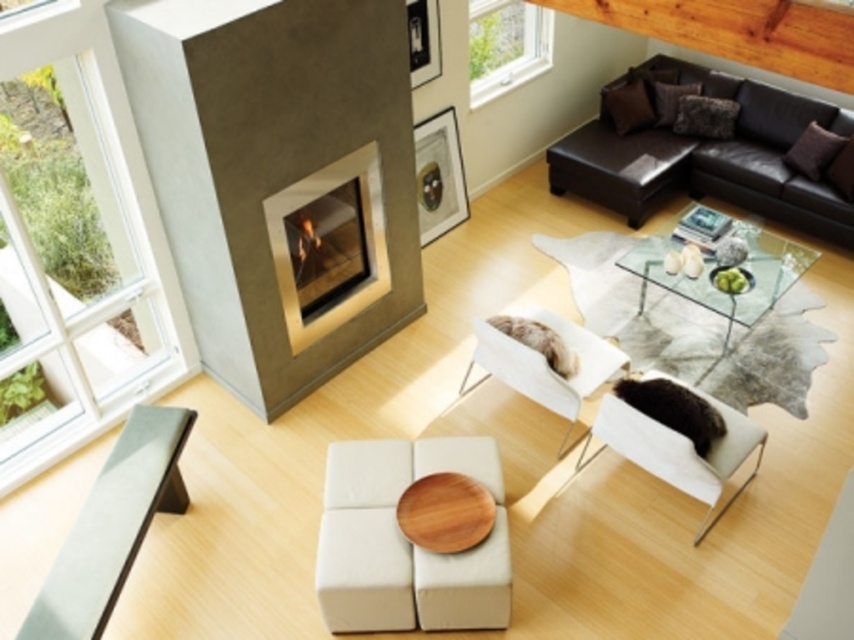
You are standing in the living room and want to take a photo of both point [705,461] and point [492,49]. Which point should you focus on first to ensure both are in clear view?

You should focus on point [705,461] first because it is closer to the camera than point [492,49], ensuring both points are in focus when using depth of field.

Looking at this image, you are standing in the living room and want to place a small potted plant exactly at the point labeled as point (757, 262). If you are currently facing the fireplace, which direction should you move to reach that point?

The point (757, 262) is 6.37 meters away from the camera. Since the fireplace is in front of you, you should move forward towards the fireplace to reach the point.